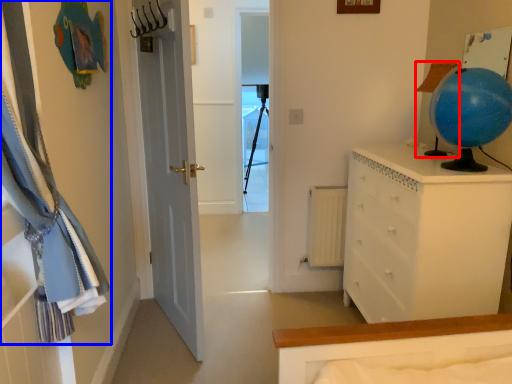
Question: Which of the following is the farthest to the observer, lamp (highlighted by a red box) or curtain (highlighted by a blue box)?

Choices:
 (A) lamp
 (B) curtain

Answer: (A)